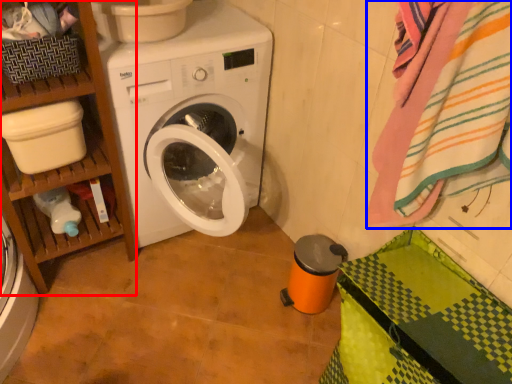
Question: Which point is further to the camera, shelf (highlighted by a red box) or bath towel (highlighted by a blue box)?

Choices:
 (A) shelf
 (B) bath towel

Answer: (A)